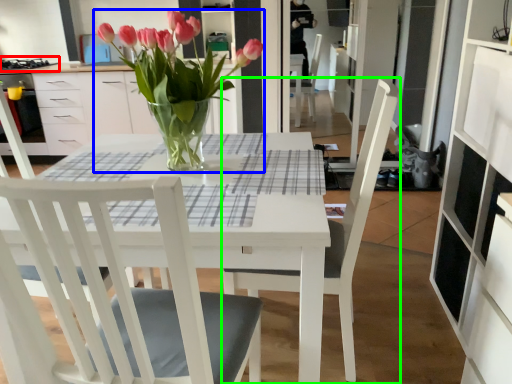
Question: Considering the real-world distances, which object is farthest from gas stove (highlighted by a red box)? houseplant (highlighted by a blue box) or chair (highlighted by a green box)?

Choices:
 (A) houseplant
 (B) chair

Answer: (B)